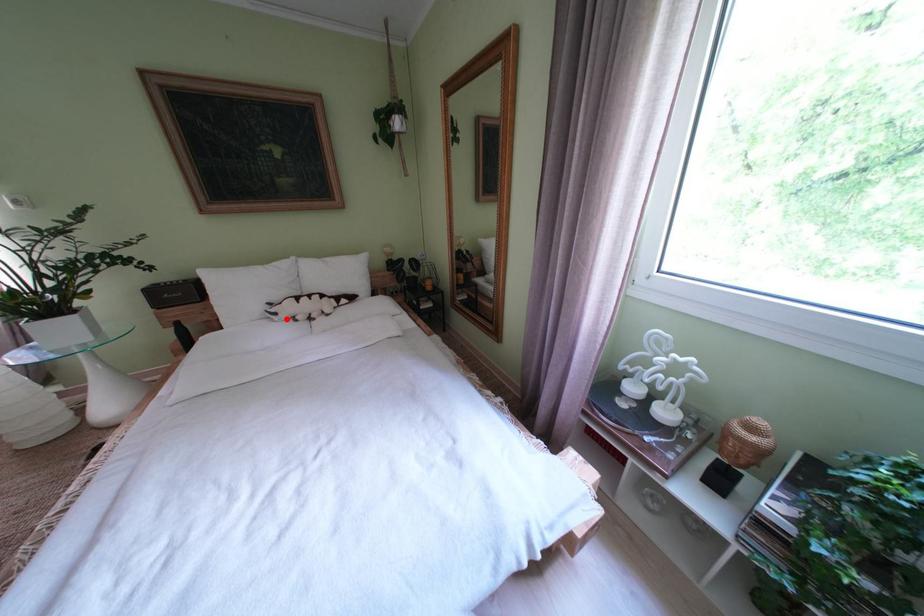
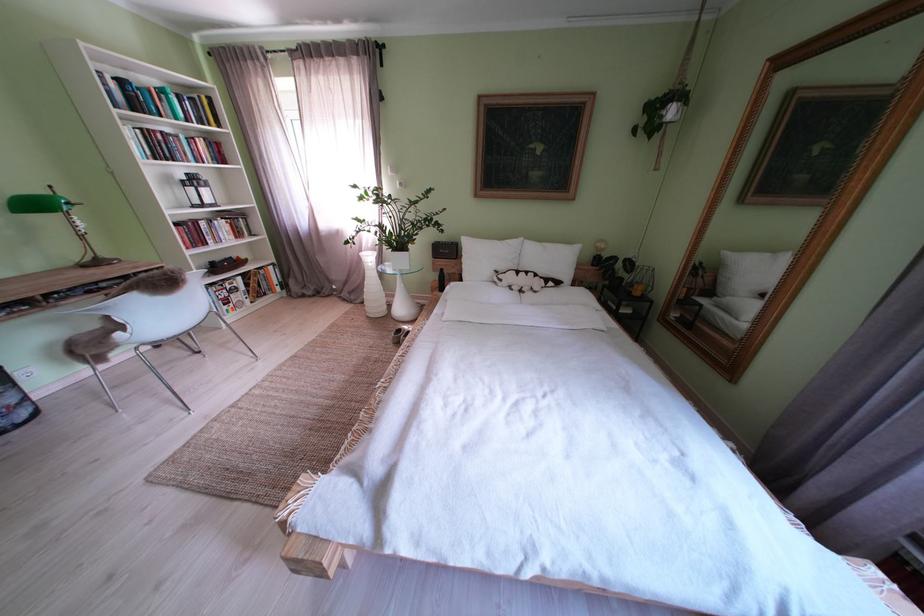
Question: I am providing you with two images of the same scene from different viewpoints. A red point is marked on the first image. Is the red point's position out of view in image 2?

Choices:
 (A) Yes
 (B) No

Answer: (B)